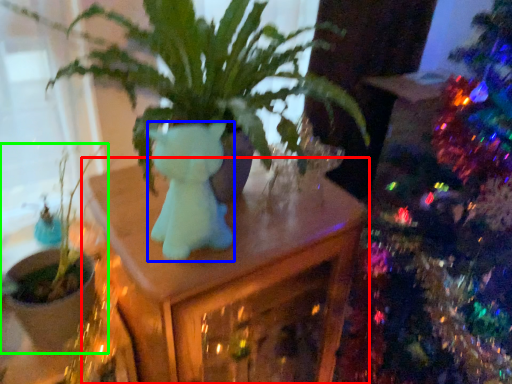
Question: Based on their relative distances, which object is nearer to table (highlighted by a red box)? Choose from animal (highlighted by a blue box) and houseplant (highlighted by a green box).

Choices:
 (A) animal
 (B) houseplant

Answer: (A)